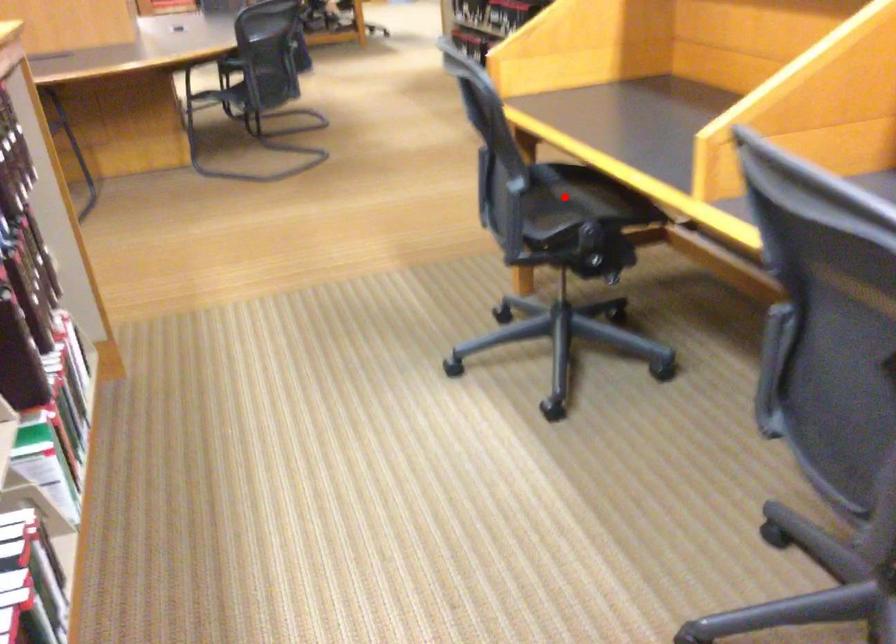
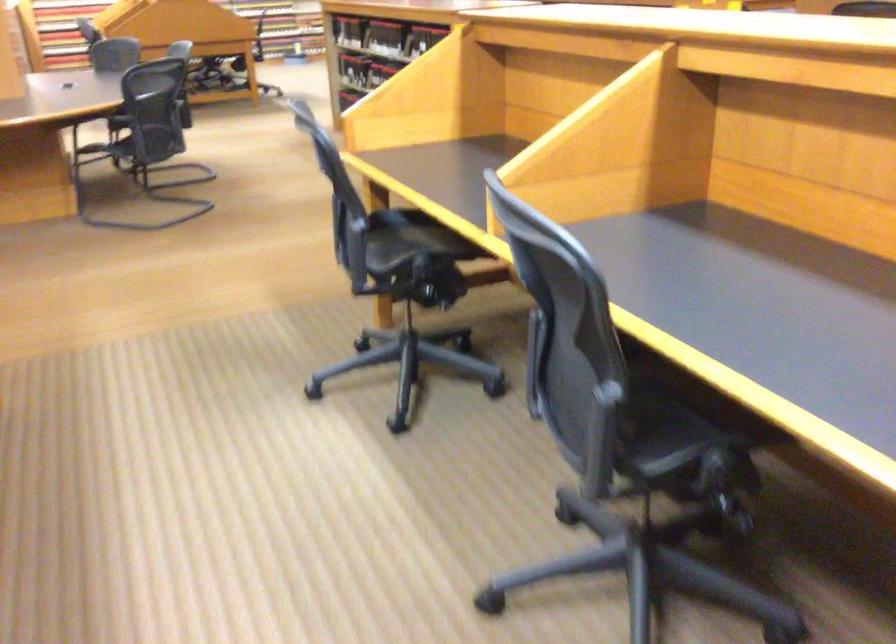
Question: I am providing you with two images of the same scene from different viewpoints. Image1 has a red point marked. In image2, the corresponding 3D location appears at what relative position? Reply with the corresponding letter.

Choices:
 (A) Closer
 (B) Farther

Answer: (B)